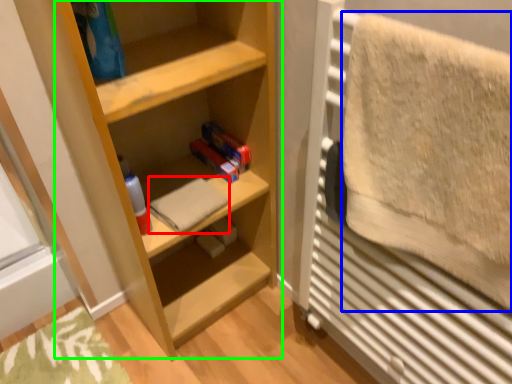
Question: Which object is the closest to the bath towel (highlighted by a red box)? Choose among these: bath towel (highlighted by a blue box) or shelf (highlighted by a green box).

Choices:
 (A) bath towel
 (B) shelf

Answer: (B)